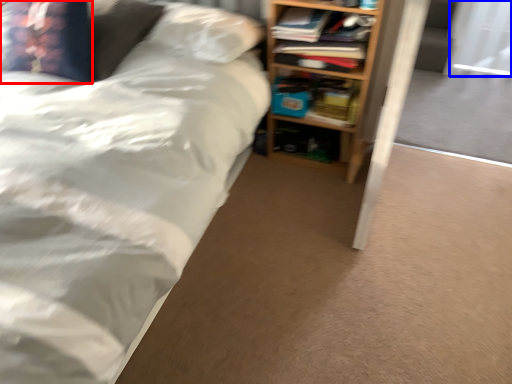
Question: Which object appears closest to the camera in this image, pillow (highlighted by a red box) or screen door (highlighted by a blue box)?

Choices:
 (A) pillow
 (B) screen door

Answer: (A)